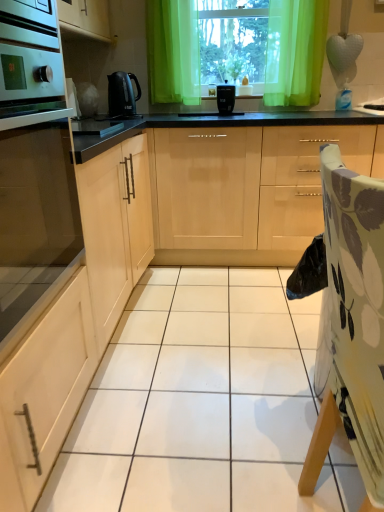
The width and height of the screenshot is (384, 512). I want to click on black plastic kettle at center, placed as the 1th kitchen appliance when sorted from left to right, so click(x=122, y=94).

The width and height of the screenshot is (384, 512). Identify the location of folding chair in front of the green sheer curtain at upper center. (353, 325).

Which point is more forward, (303, 20) or (366, 408)?

The point (366, 408) is closer to the camera.

Is the depth of green sheer curtain at upper center greater than that of floral fabric folding chair at right?

Yes, green sheer curtain at upper center is behind floral fabric folding chair at right.

Who is bigger, green sheer curtains at upper center or green sheer curtain at upper center?

green sheer curtains at upper center is bigger.

Considering the positions of objects green sheer curtains at upper center and green sheer curtain at upper center in the image provided, who is in front, green sheer curtains at upper center or green sheer curtain at upper center?

green sheer curtain at upper center is in front.

Would you say green sheer curtains at upper center is inside or outside green sheer curtain at upper center?

green sheer curtains at upper center is located beyond the bounds of green sheer curtain at upper center.

Between point (109, 79) and point (228, 130), which one is positioned in front?

The point (228, 130) is in front.

Considering the sizes of objects black plastic kettle at center, placed as the 1th kitchen appliance when sorted from left to right, and light wood cabinet at center, the first cabinetry when ordered from right to left, in the image provided, who is wider, black plastic kettle at center, placed as the 1th kitchen appliance when sorted from left to right, or light wood cabinet at center, the first cabinetry when ordered from right to left,?

light wood cabinet at center, the first cabinetry when ordered from right to left.

From the picture: Who is smaller, black plastic kettle at center, placed as the 1th kitchen appliance when sorted from left to right, or light wood cabinet at center, which appears as the 3th cabinetry when viewed from the left?

black plastic kettle at center, placed as the 1th kitchen appliance when sorted from left to right.

From a real-world perspective, between black plastic kettle at center, placed as the 1th kitchen appliance when sorted from left to right, and light wood cabinet at center, which appears as the 3th cabinetry when viewed from the left, who is vertically higher?

black plastic kettle at center, placed as the 1th kitchen appliance when sorted from left to right, from a real-world perspective.

From a real-world perspective, which is physically above, floral fabric folding chair at right or black plastic kettle at center, placed as the 1th kitchen appliance when sorted from left to right?

black plastic kettle at center, placed as the 1th kitchen appliance when sorted from left to right, is physically above.

Consider the image. Does floral fabric folding chair at right come in front of black plastic kettle at center, placed as the 1th kitchen appliance when sorted from left to right?

Yes, floral fabric folding chair at right is closer to the camera.

From a real-world perspective, count 2nd kitchen appliances upward from the floral fabric folding chair at right and point to it. Please provide its 2D coordinates.

[(122, 94)]

Is satin wood cabinet at left, arranged as the 2th cabinetry when viewed from the right, bigger or smaller than floral fabric folding chair at right?

Considering their sizes, satin wood cabinet at left, arranged as the 2th cabinetry when viewed from the right, takes up less space than floral fabric folding chair at right.

Does satin wood cabinet at left, arranged as the 2th cabinetry when viewed from the right, have a lesser height compared to floral fabric folding chair at right?

Yes.

From the image's perspective, count 1st cabinetrys upward from the floral fabric folding chair at right and point to it. Please provide its 2D coordinates.

[(35, 225)]

Can you tell me how much satin wood cabinet at left, which is the 2th cabinetry from left to right, and floral fabric folding chair at right differ in facing direction?

The angle between the facing direction of satin wood cabinet at left, which is the 2th cabinetry from left to right, and the facing direction of floral fabric folding chair at right is 4.59 degrees.

From a real-world perspective, is light wood cabinet at center, the first cabinetry when ordered from right to left, physically below black plastic kettle at center, placed as the 1th kitchen appliance when sorted from left to right?

Yes, from a real-world perspective, light wood cabinet at center, the first cabinetry when ordered from right to left, is under black plastic kettle at center, placed as the 1th kitchen appliance when sorted from left to right.

Does light wood cabinet at center, the first cabinetry when ordered from right to left, have a smaller size compared to black plastic kettle at center, placed as the 1th kitchen appliance when sorted from left to right?

Incorrect, light wood cabinet at center, the first cabinetry when ordered from right to left, is not smaller in size than black plastic kettle at center, placed as the 1th kitchen appliance when sorted from left to right.

Consider the image. Considering their positions, is light wood cabinet at center, which appears as the 3th cabinetry when viewed from the left, located in front of or behind black plastic kettle at center, placed as the 1th kitchen appliance when sorted from left to right?

light wood cabinet at center, which appears as the 3th cabinetry when viewed from the left, is positioned closer to the viewer than black plastic kettle at center, placed as the 1th kitchen appliance when sorted from left to right.

Who is taller, light wood cabinet at center, the first cabinetry when ordered from right to left, or black plastic kettle at center, placed as the 1th kitchen appliance when sorted from left to right?

With more height is light wood cabinet at center, the first cabinetry when ordered from right to left.

Is black plastic toaster at center, which is counted as the second kitchen appliance, starting from the left, taller or shorter than floral fabric folding chair at right?

black plastic toaster at center, which is counted as the second kitchen appliance, starting from the left, is shorter than floral fabric folding chair at right.

Is black plastic toaster at center, arranged as the 1th kitchen appliance when viewed from the right, aimed at floral fabric folding chair at right?

Yes, black plastic toaster at center, arranged as the 1th kitchen appliance when viewed from the right, is facing floral fabric folding chair at right.

From the image's perspective, is black plastic toaster at center, arranged as the 1th kitchen appliance when viewed from the right, positioned above or below floral fabric folding chair at right?

Based on their image positions, black plastic toaster at center, arranged as the 1th kitchen appliance when viewed from the right, is located above floral fabric folding chair at right.

Locate an element on the screen. This screenshot has height=512, width=384. curtain behind the floral fabric folding chair at right is located at coordinates (295, 52).

I want to click on window screen above the green sheer curtain at upper center (from the image's perspective), so click(233, 42).

Estimate the real-world distances between objects in this image. Which object is closer to satin wood cabinet at left, arranged as the 2th cabinetry when viewed from the right, black plastic toaster at center, which is counted as the second kitchen appliance, starting from the left, or floral fabric folding chair at right?

floral fabric folding chair at right is closer to satin wood cabinet at left, arranged as the 2th cabinetry when viewed from the right.

Looking at the image, which one is located further to green sheer curtain at upper center, floral fabric folding chair at right or green sheer curtains at upper center?

floral fabric folding chair at right.

Estimate the real-world distances between objects in this image. Which object is closer to black plastic toaster at center, which is counted as the second kitchen appliance, starting from the left, matte wood cabinet at left, the 1th cabinetry from the left, or green sheer curtain at upper center?

Based on the image, green sheer curtain at upper center appears to be nearer to black plastic toaster at center, which is counted as the second kitchen appliance, starting from the left.

Looking at the image, which one is located further to matte wood cabinet at left, the 1th cabinetry from the left, green sheer curtains at upper center or black plastic kettle at center, positioned as the 2th kitchen appliance in right-to-left order?

green sheer curtains at upper center lies further to matte wood cabinet at left, the 1th cabinetry from the left, than the other object.

From the image, which object appears to be farther from green sheer curtains at upper center, matte wood cabinet at left, the 1th cabinetry from the left, or black plastic toaster at center, arranged as the 1th kitchen appliance when viewed from the right?

The object further to green sheer curtains at upper center is matte wood cabinet at left, the 1th cabinetry from the left.

Estimate the real-world distances between objects in this image. Which object is closer to light wood cabinet at center, the first cabinetry when ordered from right to left, matte wood cabinet at left, the 1th cabinetry from the left, or green sheer curtain at upper center?

Among the two, green sheer curtain at upper center is located nearer to light wood cabinet at center, the first cabinetry when ordered from right to left.

When comparing their distances from green sheer curtain at upper center, does satin wood cabinet at left, which is the 2th cabinetry from left to right, or light wood cabinet at center, which appears as the 3th cabinetry when viewed from the left, seem further?

Among the two, satin wood cabinet at left, which is the 2th cabinetry from left to right, is located further to green sheer curtain at upper center.

Looking at the image, which one is located further to matte wood cabinet at left, the 1th cabinetry from the left, light wood cabinet at center, which appears as the 3th cabinetry when viewed from the left, or satin wood cabinet at left, which is the 2th cabinetry from left to right?

The object further to matte wood cabinet at left, the 1th cabinetry from the left, is light wood cabinet at center, which appears as the 3th cabinetry when viewed from the left.

Locate an element on the screen. The width and height of the screenshot is (384, 512). cabinetry situated between black plastic kettle at center, placed as the 1th kitchen appliance when sorted from left to right, and green sheer curtain at upper center from left to right is located at coordinates (242, 180).

Find the location of a particular element. cabinetry between matte wood cabinet at left, the 1th cabinetry from the left, and black plastic toaster at center, arranged as the 1th kitchen appliance when viewed from the right, in the front-back direction is located at coordinates (242, 180).

You are a GUI agent. You are given a task and a screenshot of the screen. Output one action in this format:
    pyautogui.click(x=<x>, y=<y>)
    Task: Click on the kitchen appliance between black plastic kettle at center, positioned as the 2th kitchen appliance in right-to-left order, and green sheer curtain at upper center from left to right
    This screenshot has width=384, height=512.
    Given the screenshot: What is the action you would take?
    pyautogui.click(x=225, y=99)

Locate an element on the screen. This screenshot has height=512, width=384. curtain between green sheer curtains at upper center and light wood cabinet at center, the first cabinetry when ordered from right to left, in the up-down direction is located at coordinates (295, 52).